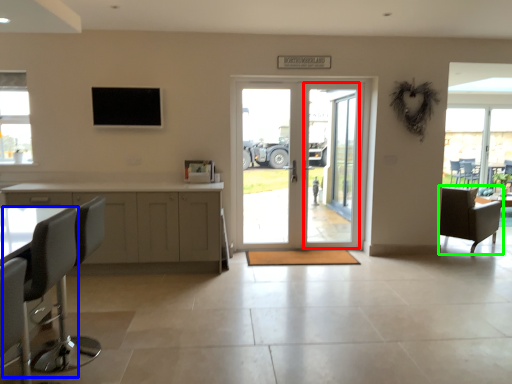
Question: Based on their relative distances, which object is farther from screen door (highlighted by a red box)? Choose from swivel chair (highlighted by a blue box) and chair (highlighted by a green box).

Choices:
 (A) swivel chair
 (B) chair

Answer: (A)